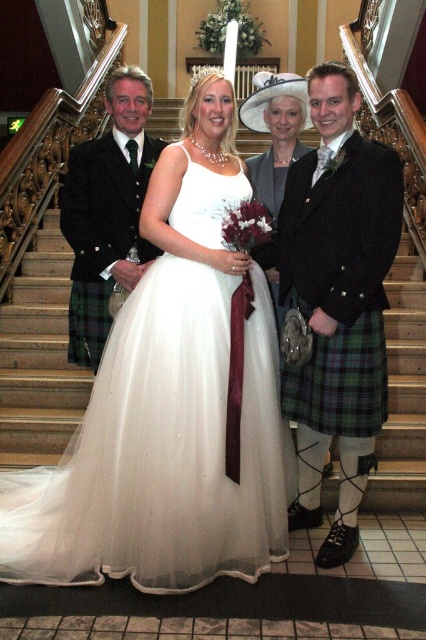
Question: Which object is farther from the camera taking this photo?

Choices:
 (A) green plaid kilt at right
 (B) white tulle dress at center

Answer: (A)

Question: Among these objects, which one is farthest from the camera?

Choices:
 (A) matte black kilt at left
 (B) green plaid kilt at right

Answer: (A)

Question: Among these objects, which one is nearest to the camera?

Choices:
 (A) matte black kilt at left
 (B) white tulle dress at center

Answer: (B)

Question: Can you confirm if white tulle dress at center is positioned below matte black kilt at left?

Choices:
 (A) yes
 (B) no

Answer: (A)

Question: Where is white tulle dress at center located in relation to matte black kilt at left in the image?

Choices:
 (A) above
 (B) below

Answer: (B)

Question: Is green plaid kilt at right to the right of matte black kilt at left from the viewer's perspective?

Choices:
 (A) yes
 (B) no

Answer: (A)